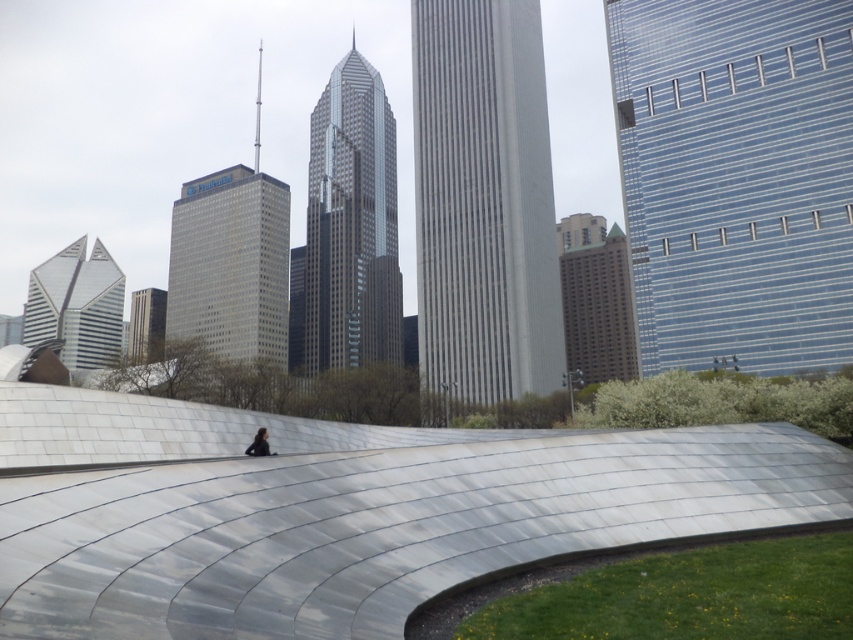
Is blue glass skyscraper at upper right thinner than gray marble skyscraper at center?

Yes, blue glass skyscraper at upper right is thinner than gray marble skyscraper at center.

Consider the image. Does blue glass skyscraper at upper right come behind gray marble skyscraper at center?

Yes.

Is point (657, 300) in front of point (515, 77)?

Yes, it is in front of point (515, 77).

The height and width of the screenshot is (640, 853). I want to click on blue glass skyscraper at upper right, so click(735, 179).

Does glassy steel skyscraper at center have a lesser height compared to dark blue fabric at center?

Incorrect, glassy steel skyscraper at center's height does not fall short of dark blue fabric at center's.

Does glassy steel skyscraper at center appear over dark blue fabric at center?

Correct, glassy steel skyscraper at center is located above dark blue fabric at center.

Between point (238, 240) and point (258, 435), which one is positioned behind?

The point (238, 240) is more distant.

Image resolution: width=853 pixels, height=640 pixels. I want to click on glassy steel skyscraper at center, so click(231, 266).

Is point (751, 490) positioned before point (735, 253)?

Yes, point (751, 490) is in front of point (735, 253).

Can you confirm if silver metallic park at center is positioned to the right of blue glass skyscraper at upper right?

No, silver metallic park at center is not to the right of blue glass skyscraper at upper right.

Who is more distant from viewer, (212,545) or (721,300)?

The point (721,300) is behind.

Where is `silver metallic park at center`? silver metallic park at center is located at coordinates (344, 509).